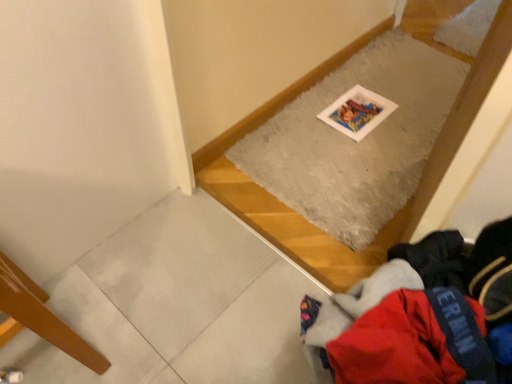
Question: In the image, is gray fluffy mat at upper center positioned in front of or behind wooden floorboard at lower left?

Choices:
 (A) behind
 (B) front

Answer: (A)

Question: In terms of height, does gray fluffy mat at upper center look taller or shorter compared to wooden floorboard at lower left?

Choices:
 (A) short
 (B) tall

Answer: (A)

Question: Estimate the real-world distances between objects in this image. Which object is farther from the gray fluffy mat at upper center?

Choices:
 (A) red fleece jacket at lower right
 (B) wooden floorboard at lower left

Answer: (B)

Question: Considering the real-world distances, which object is closest to the gray fluffy mat at upper center?

Choices:
 (A) red fleece jacket at lower right
 (B) wooden floorboard at lower left

Answer: (A)